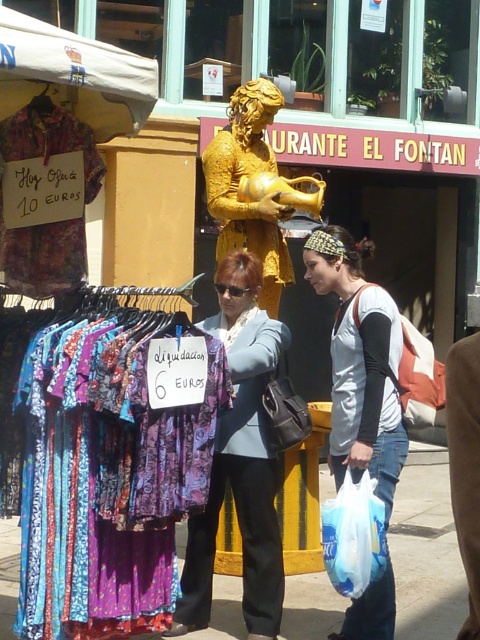
Question: Which point appears farthest from the camera in this image?

Choices:
 (A) (228, 170)
 (B) (354, 572)
 (C) (49, 252)
 (D) (171, 442)

Answer: (A)

Question: Is the position of gold textured statue at center more distant than that of white plastic bag at lower right?

Choices:
 (A) yes
 (B) no

Answer: (A)

Question: Which of these objects is positioned closest to the white plastic bag at lower right?

Choices:
 (A) floral fabric dress at left
 (B) white cotton t-shirt at center

Answer: (B)

Question: Is white cotton t-shirt at center above white plastic bag at lower right?

Choices:
 (A) yes
 (B) no

Answer: (A)

Question: Considering the relative positions of gold textured statue at center and white plastic bag at lower right in the image provided, where is gold textured statue at center located with respect to white plastic bag at lower right?

Choices:
 (A) above
 (B) below

Answer: (A)

Question: Which of these objects is positioned closest to the floral fabric dress at left?

Choices:
 (A) white cotton t-shirt at center
 (B) printed fabric dress at center
 (C) white plastic bag at lower right

Answer: (B)